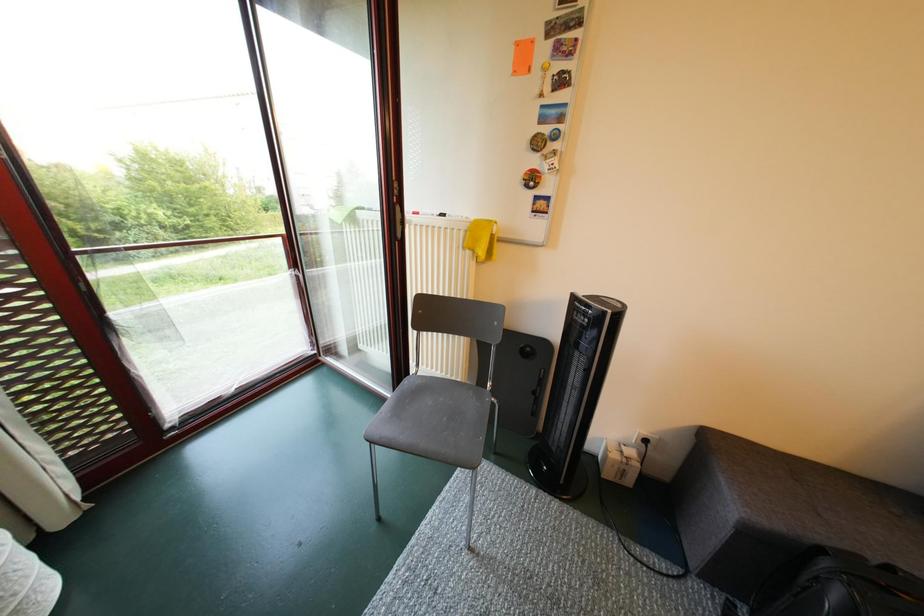
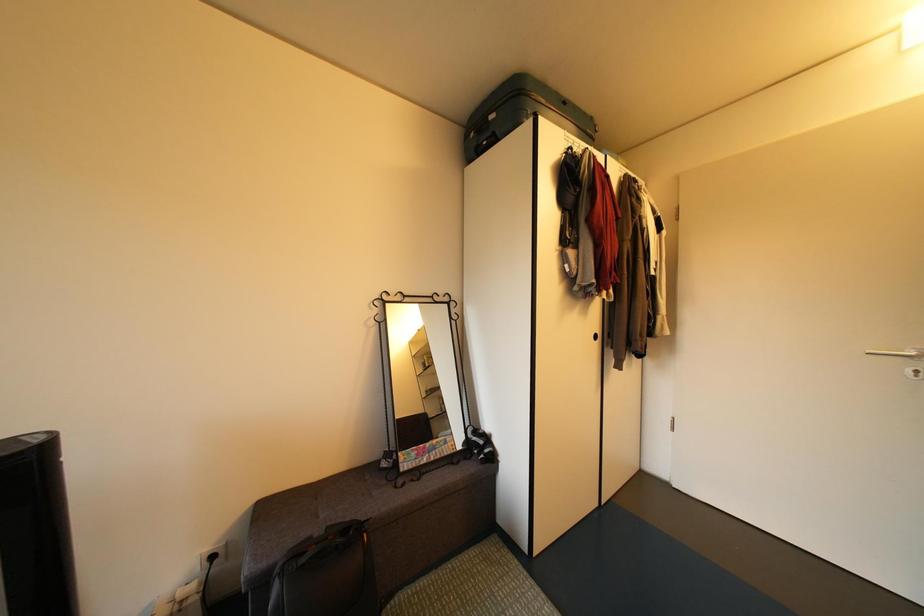
Question: Based on the continuous images, in which direction is the camera rotating? Reply with the corresponding letter.

Choices:
 (A) Left
 (B) Right
 (C) Up
 (D) Down

Answer: (B)